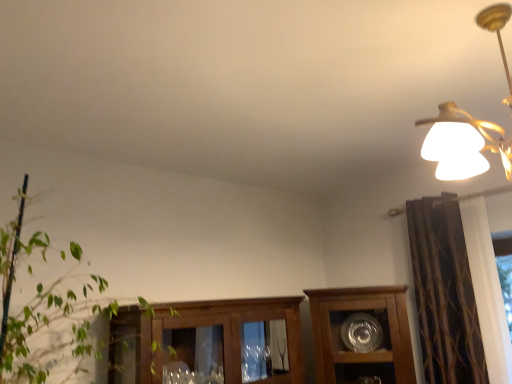
Question: From the image's perspective, is matte gold chandelier at upper right on top of wooden cabinet at center?

Choices:
 (A) no
 (B) yes

Answer: (B)

Question: Is there a large distance between matte gold chandelier at upper right and wooden cabinet at center?

Choices:
 (A) no
 (B) yes

Answer: (B)

Question: From a real-world perspective, is matte gold chandelier at upper right below wooden cabinet at center?

Choices:
 (A) yes
 (B) no

Answer: (B)

Question: Is matte gold chandelier at upper right smaller than wooden cabinet at center?

Choices:
 (A) yes
 (B) no

Answer: (A)

Question: Is the surface of matte gold chandelier at upper right in direct contact with wooden cabinet at center?

Choices:
 (A) yes
 (B) no

Answer: (B)

Question: Is matte gold chandelier at upper right completely or partially outside of wooden cabinet at center?

Choices:
 (A) no
 (B) yes

Answer: (B)

Question: Could brown textured curtain at right be considered to be inside green leafy plant at left?

Choices:
 (A) yes
 (B) no

Answer: (B)

Question: Does green leafy plant at left have a smaller size compared to brown textured curtain at right?

Choices:
 (A) no
 (B) yes

Answer: (A)

Question: From the image's perspective, is green leafy plant at left beneath brown textured curtain at right?

Choices:
 (A) no
 (B) yes

Answer: (A)

Question: Does green leafy plant at left come in front of brown textured curtain at right?

Choices:
 (A) yes
 (B) no

Answer: (A)

Question: Considering the relative sizes of green leafy plant at left and brown textured curtain at right in the image provided, is green leafy plant at left wider than brown textured curtain at right?

Choices:
 (A) yes
 (B) no

Answer: (A)

Question: Is green leafy plant at left thinner than brown textured curtain at right?

Choices:
 (A) yes
 (B) no

Answer: (B)

Question: Does wooden cabinet at center touch brown textured curtain at right?

Choices:
 (A) no
 (B) yes

Answer: (A)